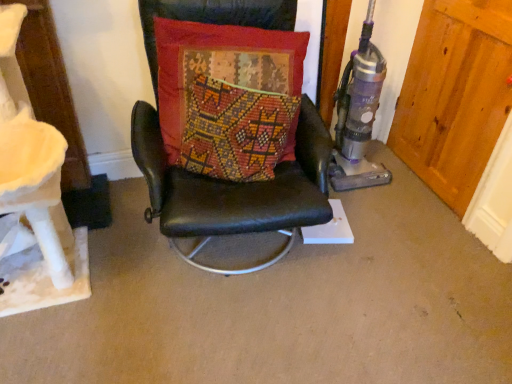
What is the approximate height of black leather chair at center?

38.12 inches.

What do you see at coordinates (228, 97) in the screenshot?
I see `textured red cushion at center` at bounding box center [228, 97].

At what (x,y) coordinates should I click in order to perform the action: click on wooden door at right. Please return your answer as a coordinate pair (x, y). Looking at the image, I should click on tap(455, 95).

Can you tell me how much black leather chair at center and textured red cushion at center differ in facing direction?

They differ by 0.0811 degrees in their facing directions.

From the image's perspective, which one is positioned higher, black leather chair at center or textured red cushion at center?

textured red cushion at center, from the image's perspective.

Based on the photo, is black leather chair at center at the right side of textured red cushion at center?

No, black leather chair at center is not to the right of textured red cushion at center.

Does black leather chair at center have a lesser height compared to textured red cushion at center?

In fact, black leather chair at center may be taller than textured red cushion at center.

Is black leather chair at center thinner than wooden door at right?

No.

From a real-world perspective, which object rests below the other?

wooden door at right.

Identify the location of chair above the wooden door at right (from a real-world perspective). (223, 180).

Is the surface of black leather chair at center in direct contact with wooden door at right?

black leather chair at center is not next to wooden door at right, and they're not touching.

Are wooden door at right and black leather chair at center beside each other?

No, wooden door at right is not making contact with black leather chair at center.

Choose the correct answer: Is wooden door at right inside black leather chair at center or outside it?

wooden door at right is located beyond the bounds of black leather chair at center.

From the picture: Considering the positions of objects wooden door at right and black leather chair at center in the image provided, who is more to the right, wooden door at right or black leather chair at center?

wooden door at right.

Looking at this image, between textured red cushion at center and black leather chair at center, which one is positioned behind?

Positioned behind is textured red cushion at center.

From a real-world perspective, is textured red cushion at center physically below black leather chair at center?

No.

In the scene shown: From the image's perspective, is textured red cushion at center under black leather chair at center?

Incorrect, from the image's perspective, textured red cushion at center is higher than black leather chair at center.

How different are the orientations of textured red cushion at center and black leather chair at center in degrees?

0.0811 degrees separate the facing orientations of textured red cushion at center and black leather chair at center.

Does wooden door at right have a larger size compared to textured red cushion at center?

Incorrect, wooden door at right is not larger than textured red cushion at center.

Is wooden door at right positioned beyond the bounds of textured red cushion at center?

Absolutely, wooden door at right is external to textured red cushion at center.

Based on the photo, is wooden door at right positioned in front of textured red cushion at center?

No, it is not.

Is wooden door at right wider than textured red cushion at center?

Incorrect, the width of wooden door at right does not surpass that of textured red cushion at center.

Is textured red cushion at center to the right of wooden door at right from the viewer's perspective?

No.

Does point (178, 55) appear closer or farther from the camera than point (409, 61)?

Clearly, point (178, 55) is closer to the camera than point (409, 61).

Locate an element on the screen. This screenshot has width=512, height=384. pillow lying in front of the wooden door at right is located at coordinates (228, 97).

The width and height of the screenshot is (512, 384). What are the coordinates of `pillow that is above the black leather chair at center (from a real-world perspective)` in the screenshot? It's located at pos(228,97).

Locate an element on the screen. chair lying in front of the wooden door at right is located at coordinates click(x=223, y=180).

Looking at the image, which one is located closer to textured red cushion at center, black leather chair at center or wooden door at right?

Based on the image, black leather chair at center appears to be nearer to textured red cushion at center.

Considering their positions, is wooden door at right positioned closer to textured red cushion at center than black leather chair at center?

black leather chair at center is positioned closer to the anchor textured red cushion at center.

When comparing their distances from wooden door at right, does black leather chair at center or textured red cushion at center seem closer?

black leather chair at center.

When comparing their distances from black leather chair at center, does textured red cushion at center or wooden door at right seem closer?

textured red cushion at center is positioned closer to the anchor black leather chair at center.

From the image, which object appears to be farther from black leather chair at center, wooden door at right or textured red cushion at center?

Among the two, wooden door at right is located further to black leather chair at center.

From the picture: Looking at the image, which one is located closer to wooden door at right, textured red cushion at center or black leather chair at center?

black leather chair at center is closer to wooden door at right.

The image size is (512, 384). In order to click on pillow situated between black leather chair at center and wooden door at right from left to right in this screenshot , I will do `click(228, 97)`.